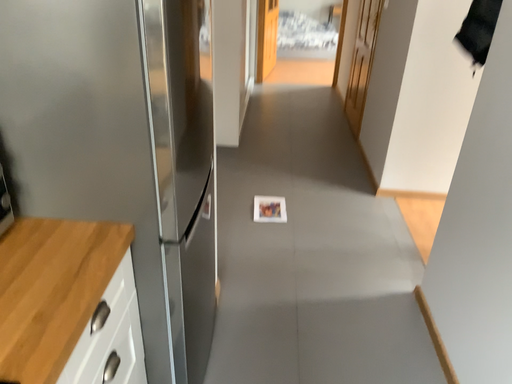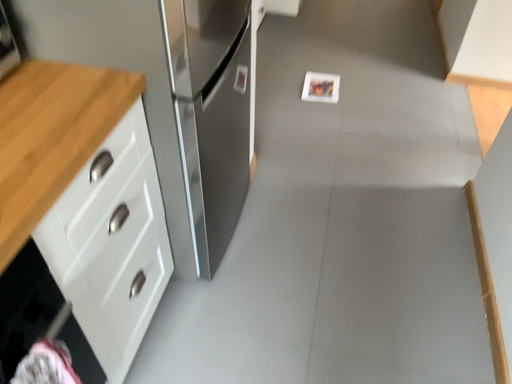
Question: Which way did the camera rotate in the video?

Choices:
 (A) rotated right
 (B) rotated left

Answer: (B)